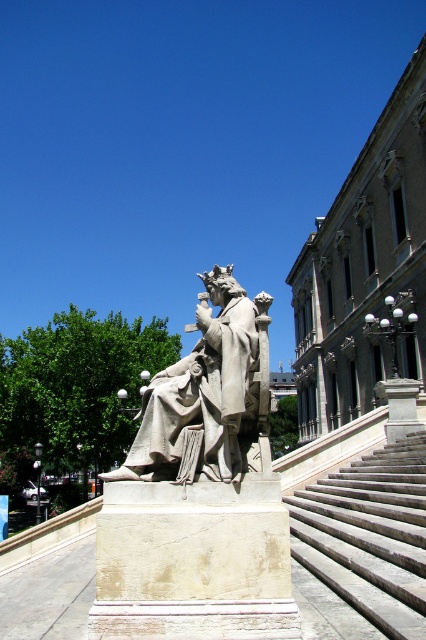
Question: Does stone stairs at center have a greater width compared to gray stone statue at center?

Choices:
 (A) no
 (B) yes

Answer: (A)

Question: Does stone statue at center lie in front of gray stone statue at center?

Choices:
 (A) no
 (B) yes

Answer: (B)

Question: Which point is closer to the camera?

Choices:
 (A) stone statue at center
 (B) gray stone statue at center

Answer: (A)

Question: Among these points, which one is farthest from the camera?

Choices:
 (A) (207, 320)
 (B) (408, 460)
 (C) (193, 465)

Answer: (B)

Question: Can you confirm if stone statue at center is wider than stone stairs at center?

Choices:
 (A) yes
 (B) no

Answer: (B)

Question: Which of these objects is positioned closest to the stone stairs at center?

Choices:
 (A) gray stone statue at center
 (B) stone statue at center

Answer: (A)